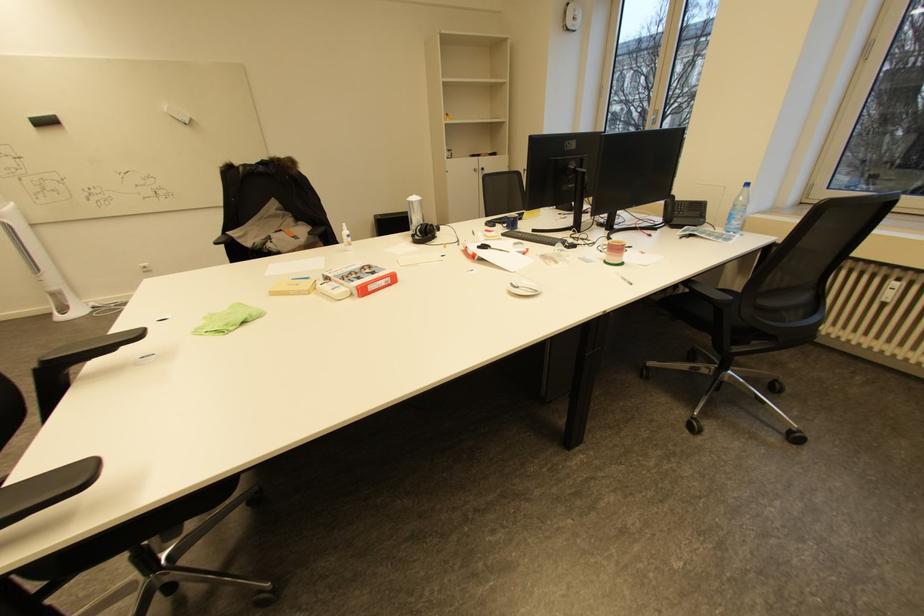
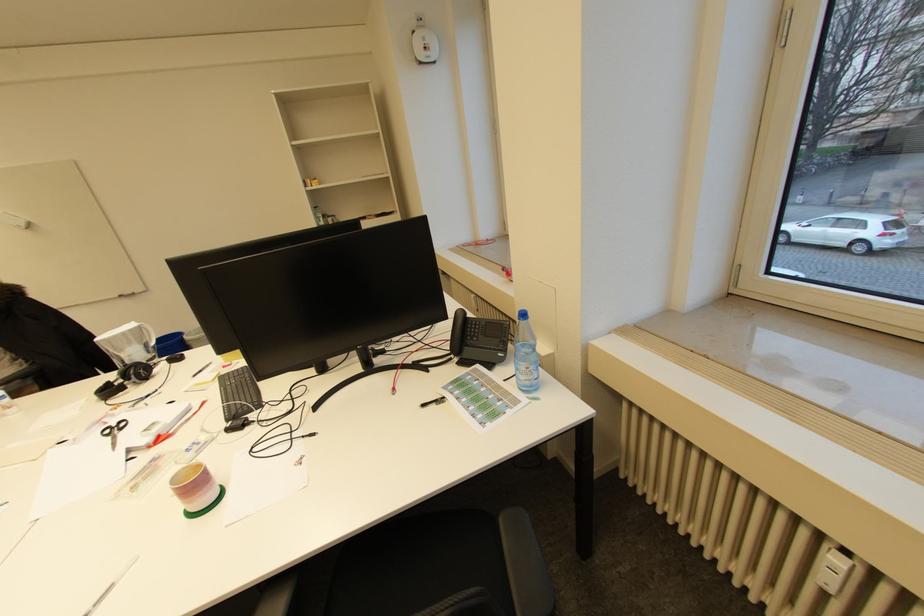
Locate, in the second image, the point that corresponds to point 488,246 in the first image.

(127, 422)